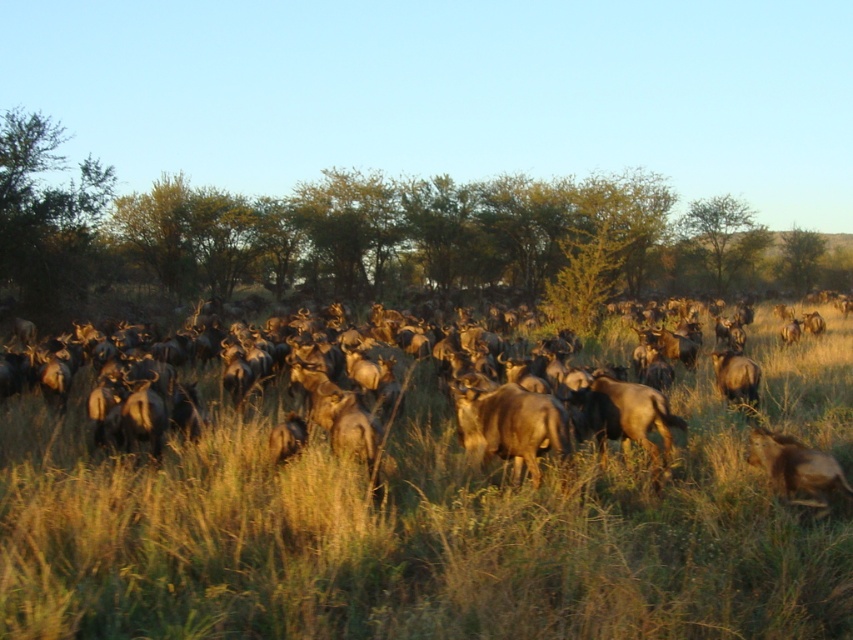
You are a photographer standing in the savanna and want to capture both the brown grassy at center and the brown furry antelope at lower right in a single frame. Which object should you focus on first to ensure both are in the shot?

The brown grassy at center is located above the brown furry antelope at lower right, so you should focus on the brown furry antelope at lower right first to ensure both are in the shot.